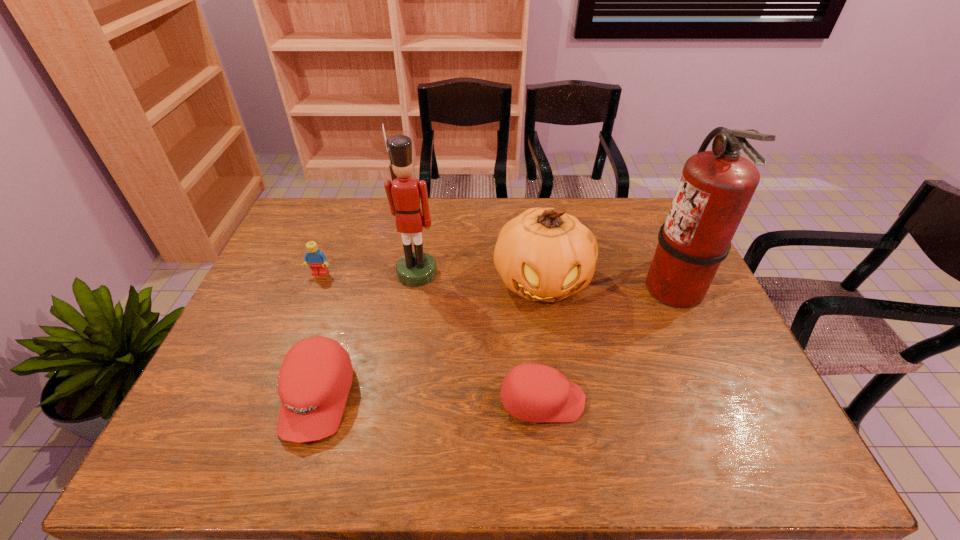
The height and width of the screenshot is (540, 960). Identify the location of vacant area situated on the face of the Lego. (295, 339).

Where is `vacant region located toward the nozzle of the rightmost object`? This screenshot has height=540, width=960. vacant region located toward the nozzle of the rightmost object is located at coordinates (560, 287).

This screenshot has height=540, width=960. Identify the location of blank space located 0.220m toward the nozzle of the rightmost object. point(570,287).

The width and height of the screenshot is (960, 540). Identify the location of free space located 0.340m toward the nozzle of the rightmost object. (530, 287).

Identify the location of object at the left edge. The image size is (960, 540). (317, 260).

At what (x,y) coordinates should I click in order to perform the action: click on object positioned at the right edge. Please return your answer as a coordinate pair (x, y). Looking at the image, I should click on (715, 188).

Identify the location of vacant space at the far edge of the desktop. This screenshot has height=540, width=960. (354, 207).

Identify the location of vacant region at the near edge of the desktop. (659, 394).

In the image, there is a desktop. Where is `vacant space at the left edge`? Image resolution: width=960 pixels, height=540 pixels. vacant space at the left edge is located at coordinates (238, 360).

The image size is (960, 540). In the image, there is a desktop. In order to click on vacant space at the right edge in this screenshot , I will do `click(704, 346)`.